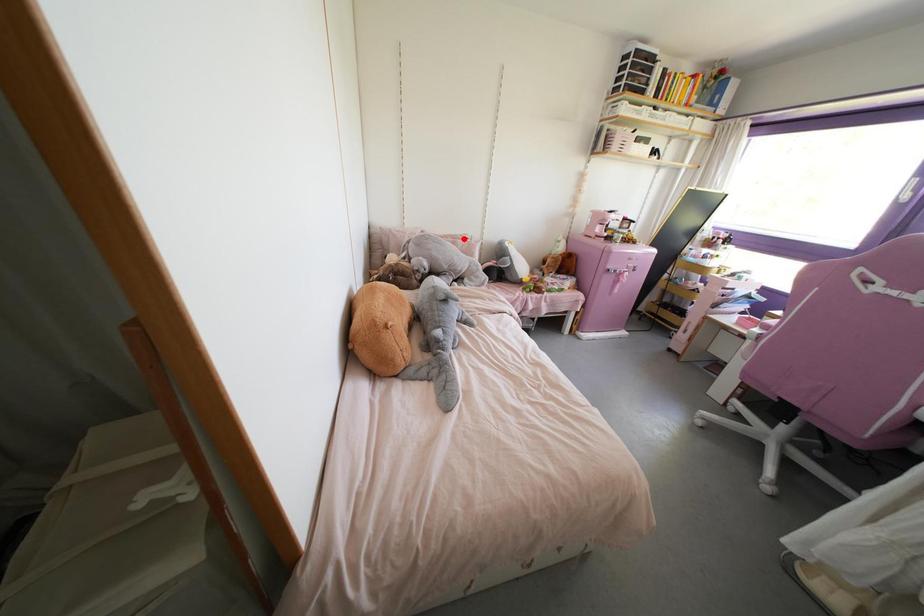
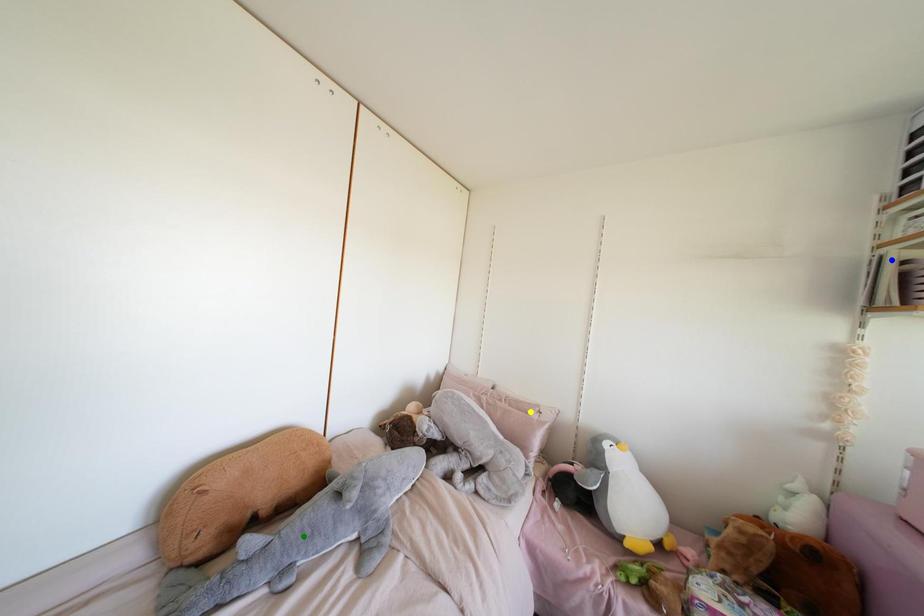
Question: I am providing you with two images of the same scene from different viewpoints. A red point is marked on the first image. You are given multiple points on the second image. In image 2, which mark is for the same physical point as the one in image 1?

Choices:
 (A) blue point
 (B) green point
 (C) yellow point

Answer: (C)